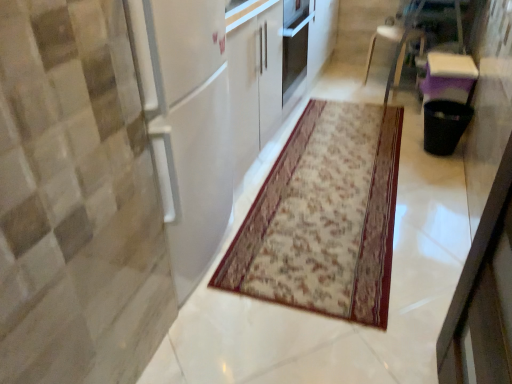
Question: Can you confirm if white plastic chair at upper right is thinner than patterned carpet at center?

Choices:
 (A) no
 (B) yes

Answer: (B)

Question: Is white plastic chair at upper right to the left of patterned carpet at center from the viewer's perspective?

Choices:
 (A) no
 (B) yes

Answer: (A)

Question: Considering the relative sizes of white plastic chair at upper right and patterned carpet at center in the image provided, is white plastic chair at upper right wider than patterned carpet at center?

Choices:
 (A) no
 (B) yes

Answer: (A)

Question: Considering the relative sizes of white plastic chair at upper right and patterned carpet at center in the image provided, is white plastic chair at upper right shorter than patterned carpet at center?

Choices:
 (A) yes
 (B) no

Answer: (B)

Question: From the image's perspective, is white plastic chair at upper right below patterned carpet at center?

Choices:
 (A) no
 (B) yes

Answer: (A)

Question: Could you tell me if white plastic chair at upper right is turned towards patterned carpet at center?

Choices:
 (A) no
 (B) yes

Answer: (A)

Question: From a real-world perspective, is patterned carpet at center under white plastic chair at upper right?

Choices:
 (A) yes
 (B) no

Answer: (A)

Question: Is patterned carpet at center closer to the viewer compared to white plastic chair at upper right?

Choices:
 (A) no
 (B) yes

Answer: (B)

Question: Is patterned carpet at center beside white plastic chair at upper right?

Choices:
 (A) yes
 (B) no

Answer: (B)

Question: Considering the relative sizes of patterned carpet at center and white plastic chair at upper right in the image provided, is patterned carpet at center smaller than white plastic chair at upper right?

Choices:
 (A) no
 (B) yes

Answer: (B)

Question: Would you say patterned carpet at center is outside white plastic chair at upper right?

Choices:
 (A) no
 (B) yes

Answer: (B)

Question: Is patterned carpet at center aimed at white plastic chair at upper right?

Choices:
 (A) yes
 (B) no

Answer: (B)

Question: Looking at the image, does patterned carpet at center seem bigger or smaller compared to white plastic chair at upper right?

Choices:
 (A) big
 (B) small

Answer: (B)